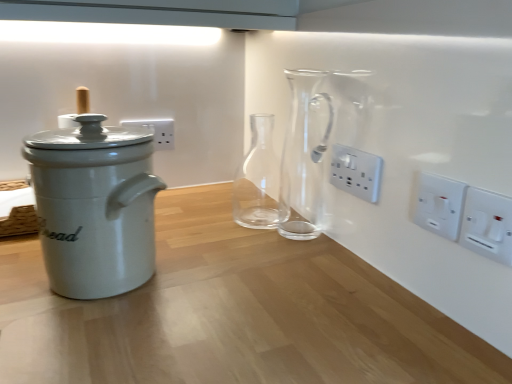
Question: Considering the relative sizes of brown woven basket at left and white plastic switch at right, arranged as the second electric outlet when viewed from the front, in the image provided, is brown woven basket at left thinner than white plastic switch at right, arranged as the second electric outlet when viewed from the front,?

Choices:
 (A) no
 (B) yes

Answer: (A)

Question: Considering the relative sizes of brown woven basket at left and white plastic switch at right, which is the 2th electric outlet in back-to-front order, in the image provided, is brown woven basket at left taller than white plastic switch at right, which is the 2th electric outlet in back-to-front order,?

Choices:
 (A) no
 (B) yes

Answer: (B)

Question: From a real-world perspective, is brown woven basket at left positioned under white plastic switch at right, arranged as the second electric outlet when viewed from the front, based on gravity?

Choices:
 (A) yes
 (B) no

Answer: (A)

Question: From the image's perspective, is brown woven basket at left located above white plastic switch at right, the 2th electric outlet in the left-to-right sequence?

Choices:
 (A) no
 (B) yes

Answer: (A)

Question: Considering the relative positions of brown woven basket at left and white plastic switch at right, arranged as the second electric outlet when viewed from the front, in the image provided, is brown woven basket at left to the right of white plastic switch at right, arranged as the second electric outlet when viewed from the front, from the viewer's perspective?

Choices:
 (A) yes
 (B) no

Answer: (B)

Question: Considering the positions of brown woven basket at left and transparent glass carafe at center, which is the first glass vase from back to front, in the image, is brown woven basket at left taller or shorter than transparent glass carafe at center, which is the first glass vase from back to front,?

Choices:
 (A) short
 (B) tall

Answer: (A)

Question: Does point (33, 221) appear closer or farther from the camera than point (243, 185)?

Choices:
 (A) closer
 (B) farther

Answer: (A)

Question: From the image's perspective, is brown woven basket at left above or below transparent glass carafe at center, which is the first glass vase from back to front?

Choices:
 (A) below
 (B) above

Answer: (A)

Question: In the image, is brown woven basket at left positioned in front of or behind transparent glass carafe at center, the 2th glass vase in the front-to-back sequence?

Choices:
 (A) front
 (B) behind

Answer: (A)

Question: Is white plastic switch at right, which is the 3th electric outlet in back-to-front order, inside or outside of white ceramic bread bin at left?

Choices:
 (A) outside
 (B) inside

Answer: (A)

Question: Visually, is white plastic switch at right, the first electric outlet viewed from the front, positioned to the left or to the right of white ceramic bread bin at left?

Choices:
 (A) left
 (B) right

Answer: (B)

Question: Does point 498,198 appear closer or farther from the camera than point 67,226?

Choices:
 (A) farther
 (B) closer

Answer: (B)

Question: From a real-world perspective, is white plastic switch at right, the 1th electric outlet positioned from the right, positioned above or below white ceramic bread bin at left?

Choices:
 (A) below
 (B) above

Answer: (B)

Question: Is point (309, 200) closer or farther from the camera than point (377, 185)?

Choices:
 (A) farther
 (B) closer

Answer: (A)

Question: From their relative heights in the image, would you say transparent glass carafe at center, the 2th glass vase in the back-to-front sequence, is taller or shorter than white plastic electrical outlet at center-right, the 3th electric outlet viewed from the right?

Choices:
 (A) short
 (B) tall

Answer: (B)